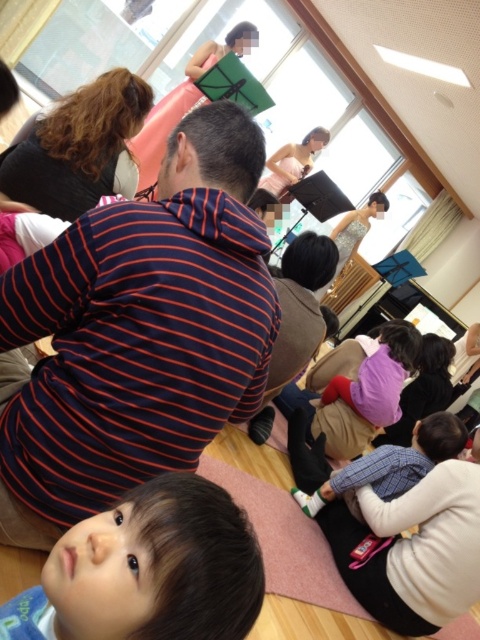
You are a photographer trying to capture a candid shot of the brown hair at lower left without the striped fabric at center blocking the view. Is this possible?

The striped fabric at center is further to the viewer than brown hair at lower left, so the striped fabric at center would block the view of the brown hair at lower left, making it impossible to capture the shot without obstruction.

You are organizing a photo shoot and need to position two props, the purple fleece at center and the plaid fabric shirt at center, in a way that they are aligned horizontally. Based on the scene description, which prop should be placed to the left to maintain their original spatial relationship?

The purple fleece at center should be placed to the left of the plaid fabric shirt at center to maintain their original spatial relationship as described.

You are standing in the room and want to hand a gift to both the purple fleece at center and the plaid fabric shirt at center. Which one should you approach first to ensure you can reach them without moving around others?

You should approach the purple fleece at center first because it is closer to you than the plaid fabric shirt at center, which is further away.